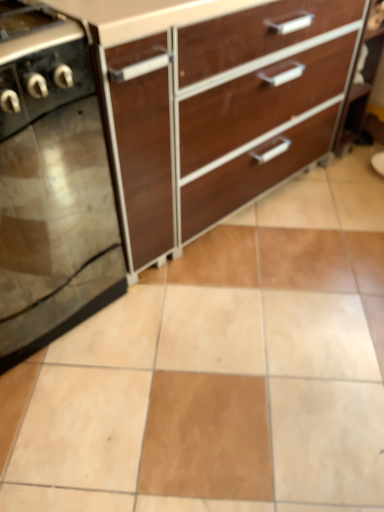
Question: Which direction should I rotate to look at brown wood chest of drawers at upper center?

Choices:
 (A) right
 (B) left

Answer: (A)

Question: Does brown wood chest of drawers at upper center have a larger size compared to black glass stove at left?

Choices:
 (A) no
 (B) yes

Answer: (B)

Question: Does brown wood chest of drawers at upper center have a lesser height compared to black glass stove at left?

Choices:
 (A) yes
 (B) no

Answer: (B)

Question: Could you tell me if brown wood chest of drawers at upper center is turned towards black glass stove at left?

Choices:
 (A) yes
 (B) no

Answer: (B)

Question: Can black glass stove at left be found inside brown wood chest of drawers at upper center?

Choices:
 (A) no
 (B) yes

Answer: (A)

Question: From the image's perspective, is brown wood chest of drawers at upper center on black glass stove at left?

Choices:
 (A) no
 (B) yes

Answer: (B)

Question: From a real-world perspective, is brown wood chest of drawers at upper center over black glass stove at left?

Choices:
 (A) yes
 (B) no

Answer: (A)

Question: Does black glass stove at left lie behind brown wood chest of drawers at upper center?

Choices:
 (A) no
 (B) yes

Answer: (A)

Question: Considering the relative sizes of black glass stove at left and brown wood chest of drawers at upper center in the image provided, is black glass stove at left wider than brown wood chest of drawers at upper center?

Choices:
 (A) yes
 (B) no

Answer: (B)

Question: Considering the relative sizes of black glass stove at left and brown wood chest of drawers at upper center in the image provided, is black glass stove at left thinner than brown wood chest of drawers at upper center?

Choices:
 (A) no
 (B) yes

Answer: (B)

Question: Is black glass stove at left shorter than brown wood chest of drawers at upper center?

Choices:
 (A) yes
 (B) no

Answer: (A)

Question: Can you confirm if black glass stove at left is positioned to the left of brown wood chest of drawers at upper center?

Choices:
 (A) yes
 (B) no

Answer: (A)

Question: From a real-world perspective, is black glass stove at left physically below brown wood chest of drawers at upper center?

Choices:
 (A) no
 (B) yes

Answer: (B)

Question: Is point (43, 285) closer or farther from the camera than point (322, 121)?

Choices:
 (A) closer
 (B) farther

Answer: (A)